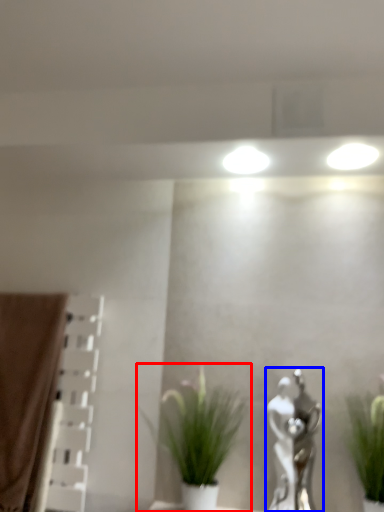
Question: Which of the following is the farthest to the observer, houseplant (highlighted by a red box) or art (highlighted by a blue box)?

Choices:
 (A) houseplant
 (B) art

Answer: (B)